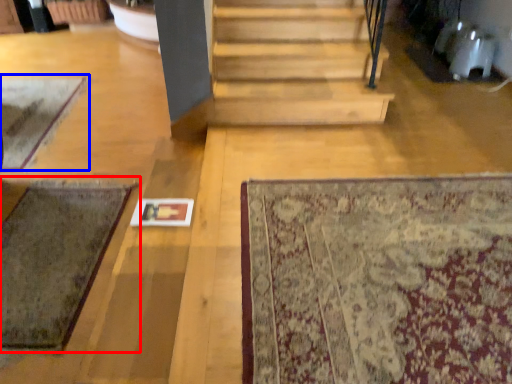
Question: Which of the following is the farthest to the observer, mat (highlighted by a red box) or mat (highlighted by a blue box)?

Choices:
 (A) mat
 (B) mat

Answer: (B)